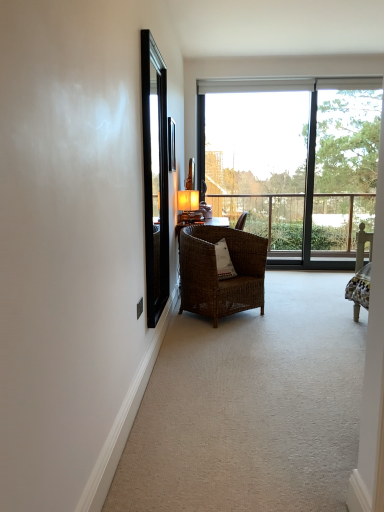
Locate an element on the screen. The width and height of the screenshot is (384, 512). vacant area situated below black glass screen door at left (from a real-world perspective) is located at coordinates (169, 343).